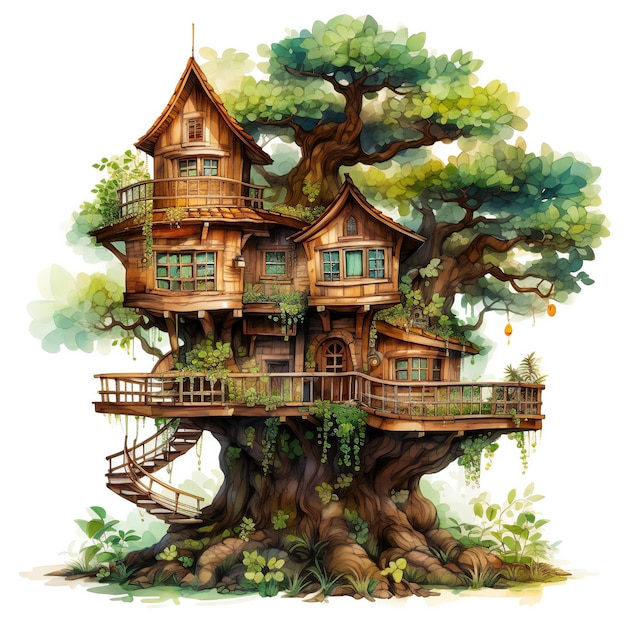
The image size is (626, 626). What are the coordinates of `door` in the screenshot? It's located at (327, 357).